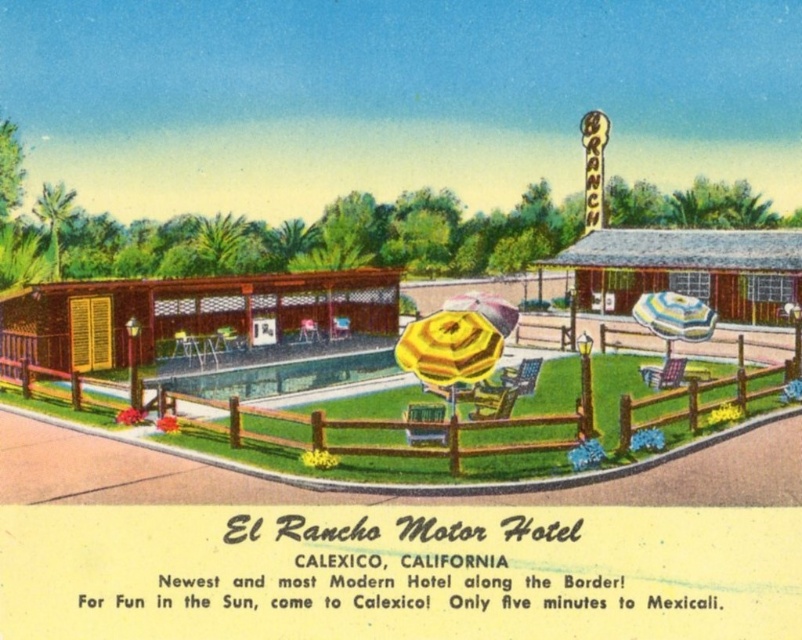
You are a guest at the El Rancho Motor Hotel and want to place a 2.5 meter long lounge chair between the brown wooden fence at lower left and the yellow striped umbrella at center. Will there be enough space?

The distance between the brown wooden fence at lower left and the yellow striped umbrella at center is 2.53 meters, so the 2.5 meter long lounge chair will fit with a small amount of space remaining.

You are a guest at the El Rancho Motor Hotel and want to take a photo of the swimming pool area. To ensure the brown wooden fence at lower left does not block the view, where should you position yourself relative to the yellow fabric umbrella at center?

Since the brown wooden fence at lower left is much taller than the yellow fabric umbrella at center, you should position yourself behind the yellow fabric umbrella at center to avoid the fence blocking the view.

You are a guest at the El Rancho Motor Hotel and want to take a photo of the yellow striped umbrella at center from the pool area. However, you notice the brown wooden fence at lower left might block your view. Based on the scene description, will the fence obstruct your view of the umbrella?

The brown wooden fence at lower left is in front of the yellow striped umbrella at center, so it will block your view of the umbrella from the pool area.